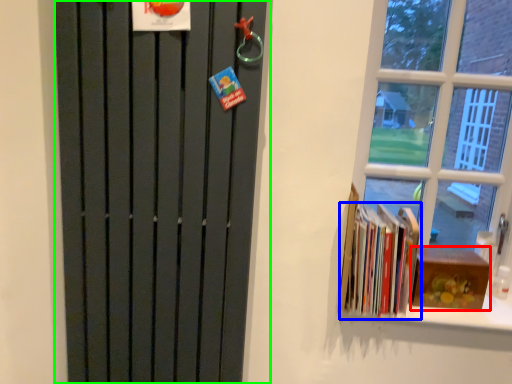
Question: Which object is positioned farthest from paperback book (highlighted by a red box)? Select from book (highlighted by a blue box) and door (highlighted by a green box).

Choices:
 (A) book
 (B) door

Answer: (B)